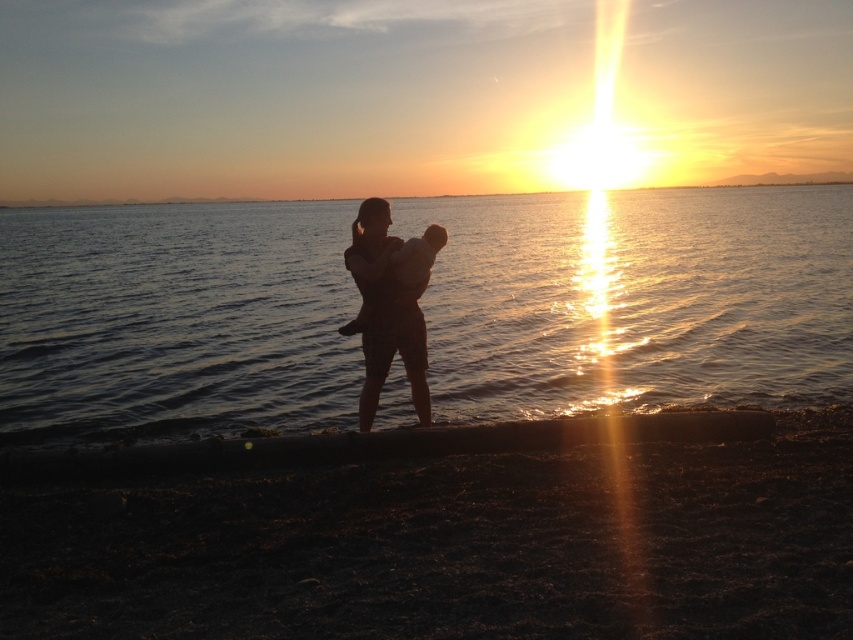
Question: Considering the relative positions of glistening water at center and dark sand at lower center in the image provided, where is glistening water at center located with respect to dark sand at lower center?

Choices:
 (A) above
 (B) below

Answer: (A)

Question: Among these points, which one is nearest to the camera?

Choices:
 (A) (415, 308)
 (B) (567, 232)

Answer: (A)

Question: Can you confirm if dark sand at lower center is wider than silhouette fabric at center?

Choices:
 (A) no
 (B) yes

Answer: (B)

Question: Can you confirm if dark sand at lower center is wider than silhouette fabric at center?

Choices:
 (A) no
 (B) yes

Answer: (B)

Question: Which of the following is the farthest from the observer?

Choices:
 (A) silhouette fabric at center
 (B) dark sand at lower center
 (C) glistening water at center

Answer: (C)

Question: Considering the real-world distances, which object is closest to the silhouette fabric at center?

Choices:
 (A) glistening water at center
 (B) dark sand at lower center

Answer: (B)